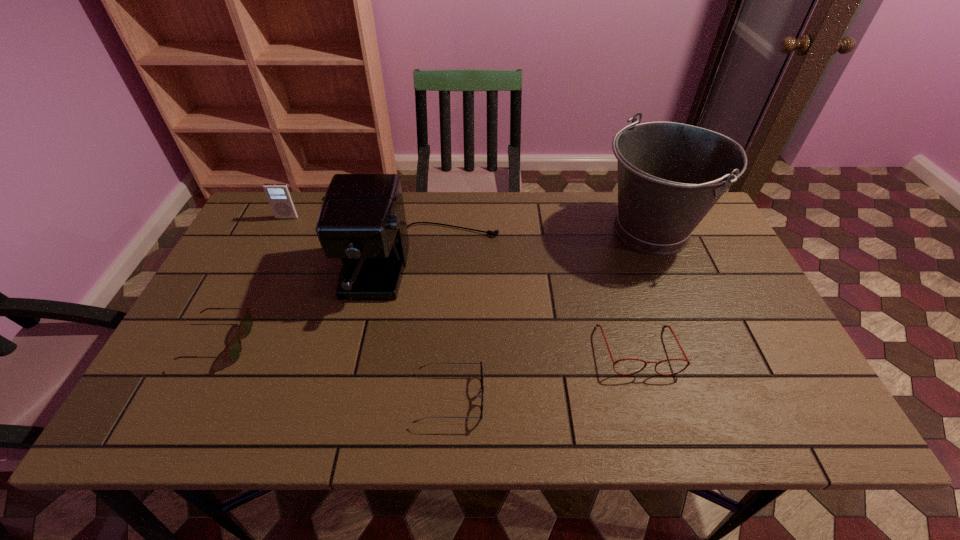
Identify which spectacles is the third nearest to the fourth shortest object. Please provide its 2D coordinates. Your answer should be formatted as a tuple, i.e. [(x, y)], where the tuple contains the x and y coordinates of a point satisfying the conditions above.

[(688, 363)]

The width and height of the screenshot is (960, 540). What are the coordinates of `spectacles that stands as the closest to the fourth tallest object` in the screenshot? It's located at (480, 396).

Identify the location of free spot that satisfies the following two spatial constraints: 1. on the front-facing side of the bucket; 2. on the right side of the fourth shortest object. This screenshot has height=540, width=960. (280, 232).